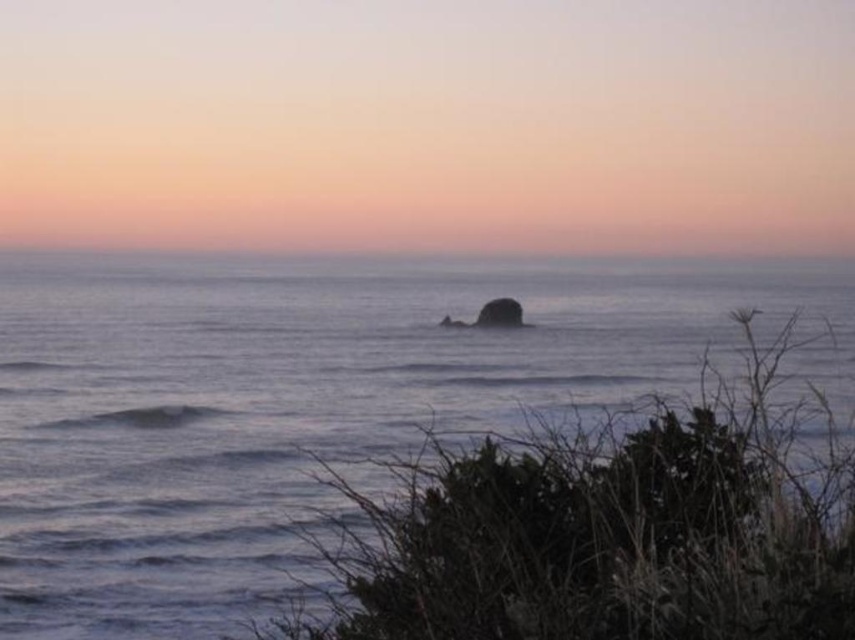
Who is taller, smooth blue water at center or smooth gray rock at center?

Standing taller between the two is smooth blue water at center.

Is point (145, 336) positioned behind point (500, 301)?

That is False.

What do you see at coordinates (310, 401) in the screenshot? The height and width of the screenshot is (640, 855). I see `smooth blue water at center` at bounding box center [310, 401].

The width and height of the screenshot is (855, 640). I want to click on smooth blue water at center, so click(x=310, y=401).